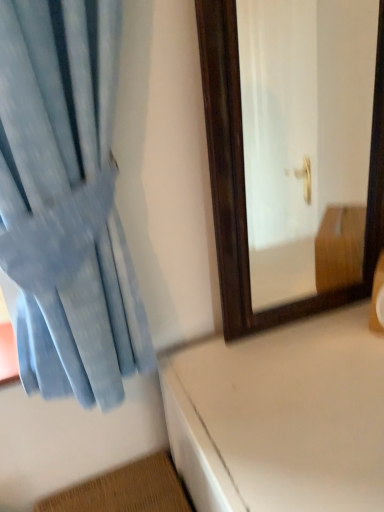
Question: Considering the relative sizes of white glossy table at lower right and light blue fabric curtain at left in the image provided, is white glossy table at lower right wider than light blue fabric curtain at left?

Choices:
 (A) no
 (B) yes

Answer: (B)

Question: Can you confirm if white glossy table at lower right is positioned to the right of light blue fabric curtain at left?

Choices:
 (A) no
 (B) yes

Answer: (B)

Question: Is white glossy table at lower right far from light blue fabric curtain at left?

Choices:
 (A) no
 (B) yes

Answer: (A)

Question: Does white glossy table at lower right have a lesser width compared to light blue fabric curtain at left?

Choices:
 (A) no
 (B) yes

Answer: (A)

Question: From a real-world perspective, is white glossy table at lower right on light blue fabric curtain at left?

Choices:
 (A) no
 (B) yes

Answer: (A)

Question: From a real-world perspective, is white glossy table at lower right beneath light blue fabric curtain at left?

Choices:
 (A) yes
 (B) no

Answer: (A)

Question: Does light blue fabric curtain at left come in front of white glossy table at lower right?

Choices:
 (A) yes
 (B) no

Answer: (A)

Question: Can you confirm if light blue fabric curtain at left is taller than white glossy table at lower right?

Choices:
 (A) yes
 (B) no

Answer: (B)

Question: Considering the relative sizes of light blue fabric curtain at left and white glossy table at lower right in the image provided, is light blue fabric curtain at left wider than white glossy table at lower right?

Choices:
 (A) no
 (B) yes

Answer: (A)

Question: Can you confirm if light blue fabric curtain at left is bigger than white glossy table at lower right?

Choices:
 (A) no
 (B) yes

Answer: (A)

Question: Does light blue fabric curtain at left turn towards white glossy table at lower right?

Choices:
 (A) no
 (B) yes

Answer: (A)

Question: Is light blue fabric curtain at left thinner than white glossy table at lower right?

Choices:
 (A) no
 (B) yes

Answer: (B)

Question: Is white glossy table at lower right to the left or to the right of light blue fabric curtain at left in the image?

Choices:
 (A) left
 (B) right

Answer: (B)